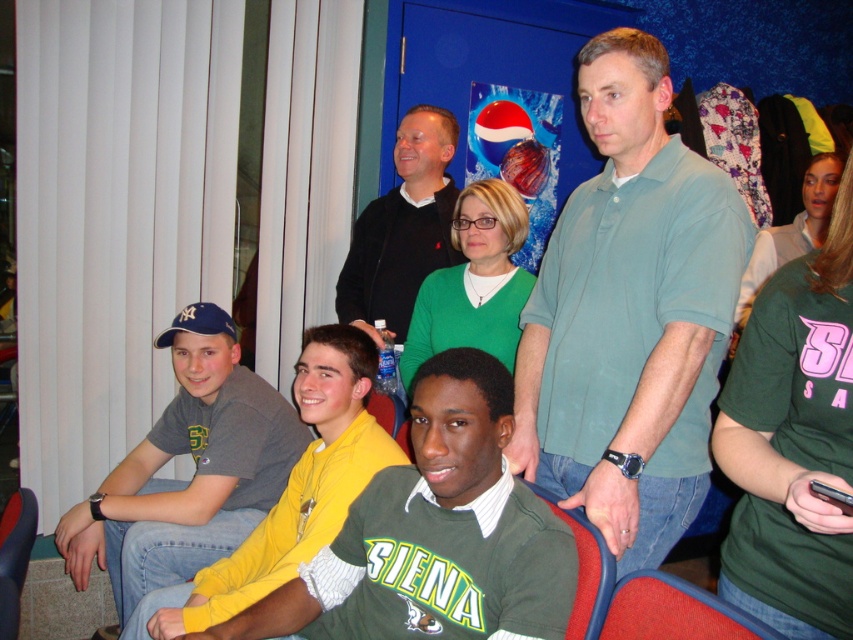
You are a photographer trying to capture a group photo of the people in the scene. You notice the green jersey at center and the red fabric chair at lower right. Which object should you focus on first if you want to ensure both are in focus, considering their sizes?

The green jersey at center is larger in size than the red fabric chair at lower right, so focusing on the larger green jersey at center will help ensure both objects are in focus.